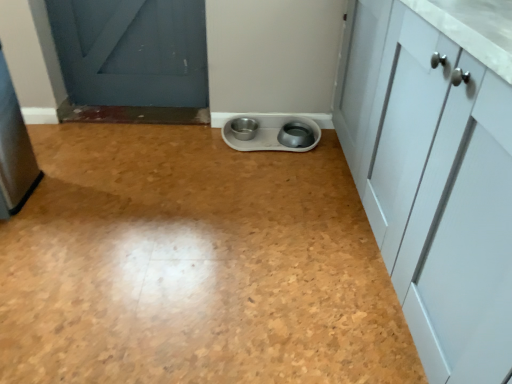
Image resolution: width=512 pixels, height=384 pixels. I want to click on free space behind brushed metal refrigerator at left, positioned as the 1th appliance in front-to-back order, so pos(56,158).